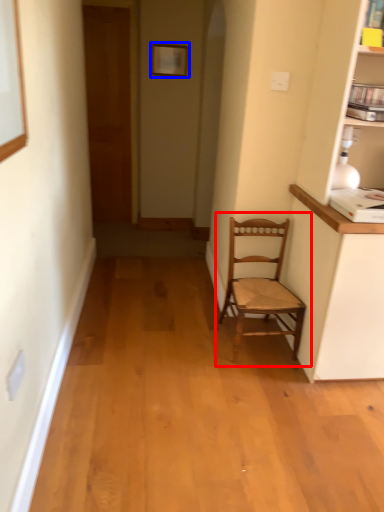
Question: Which point is further to the camera, chair (highlighted by a red box) or picture frame (highlighted by a blue box)?

Choices:
 (A) chair
 (B) picture frame

Answer: (B)